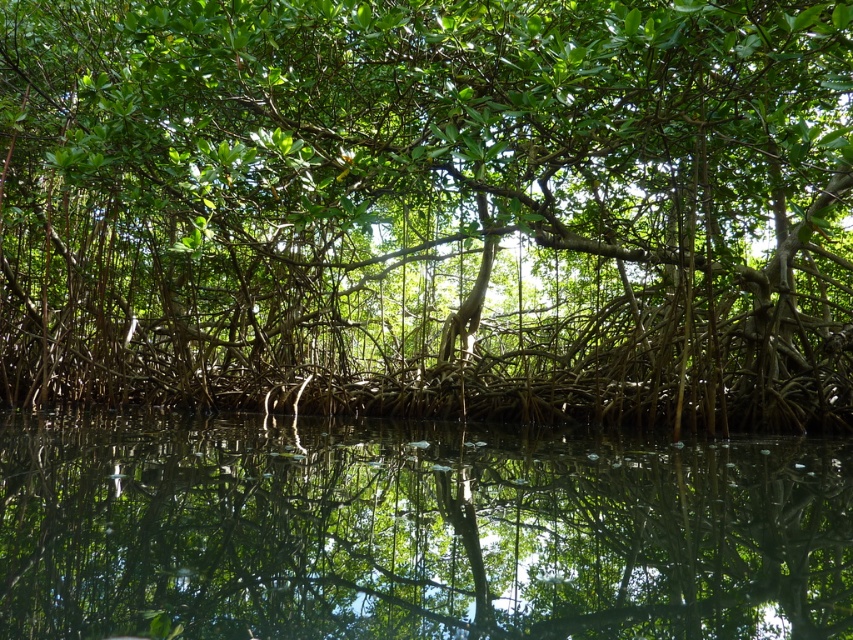
You are a bird flying over the mangrove forest. You see the green leafy tree at center and the transparent water at center. Which one is higher from the ground?

The green leafy tree at center is much taller than transparent water at center, so the green leafy tree at center is higher from the ground.

You are a bird flying over the mangrove forest. You need to land on the green leafy tree at center or the transparent water at center. Which surface is wider and safer for landing?

The green leafy tree at center might be wider than transparent water at center, so it is safer for landing.

You are standing in the mangrove forest and notice a point marked at coordinates (431, 209). According to the scene description, what object is located at that point?

The point at coordinates (431, 209) indicates a green leafy tree at center.